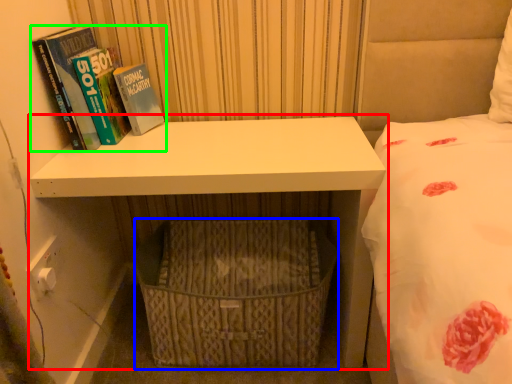
Question: Which object is the closest to the shelf (highlighted by a red box)? Choose among these: basket (highlighted by a blue box) or book (highlighted by a green box).

Choices:
 (A) basket
 (B) book

Answer: (A)